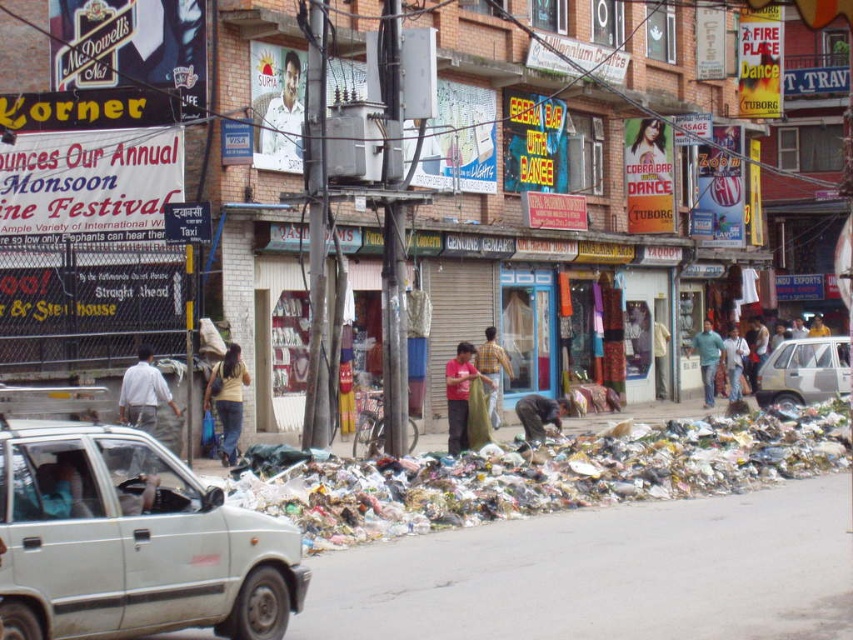
You are a delivery person who needs to place a package on the ground near the multicolored plastic bags at lower center. According to the image, what are the exact coordinates where you should place the package?

The multicolored plastic bags at lower center are located at point (546,474), so you should place the package near those coordinates.

You are a delivery person standing at the camera position. You need to move your silver metallic car at right to a parking spot 100 feet away. Can you reach the parking spot without moving the car?

The silver metallic car at right is 79.63 feet away from the camera. Since the parking spot is 100 feet away, you can reach it without moving the car because the distance from the camera to the car is less than 100 feet.